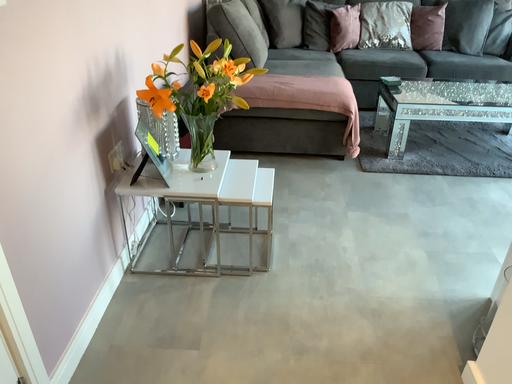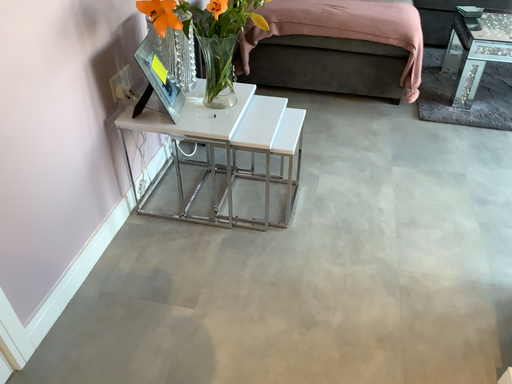
Question: Which way did the camera rotate in the video?

Choices:
 (A) rotated right
 (B) rotated left

Answer: (B)